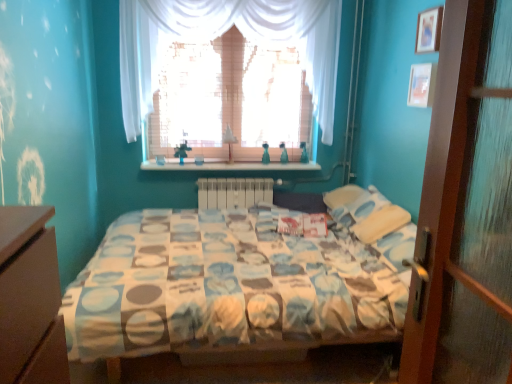
Question: Does wooden shelf at center have a lesser width compared to wooden picture frame at upper right, the 1th picture frame when ordered from bottom to top?

Choices:
 (A) no
 (B) yes

Answer: (A)

Question: Considering the relative sizes of wooden shelf at center and wooden picture frame at upper right, the 2th picture frame positioned from the top, in the image provided, is wooden shelf at center wider than wooden picture frame at upper right, the 2th picture frame positioned from the top,?

Choices:
 (A) yes
 (B) no

Answer: (A)

Question: Is wooden shelf at center not near wooden picture frame at upper right, the 2th picture frame positioned from the top?

Choices:
 (A) yes
 (B) no

Answer: (A)

Question: Is wooden shelf at center further to the viewer compared to wooden picture frame at upper right, the 1th picture frame when ordered from bottom to top?

Choices:
 (A) no
 (B) yes

Answer: (B)

Question: Is wooden picture frame at upper right, the 2th picture frame positioned from the top, a part of wooden shelf at center?

Choices:
 (A) no
 (B) yes

Answer: (A)

Question: Considering the positions of point (426, 36) and point (248, 203), is point (426, 36) closer or farther from the camera than point (248, 203)?

Choices:
 (A) farther
 (B) closer

Answer: (B)

Question: Considering the positions of wooden picture frame at upper right, which appears as the second picture frame when ordered from the bottom, and white plastic radiator at center in the image, is wooden picture frame at upper right, which appears as the second picture frame when ordered from the bottom, taller or shorter than white plastic radiator at center?

Choices:
 (A) short
 (B) tall

Answer: (A)

Question: Is wooden picture frame at upper right, which appears as the second picture frame when ordered from the bottom, spatially inside white plastic radiator at center, or outside of it?

Choices:
 (A) outside
 (B) inside

Answer: (A)

Question: Is wooden picture frame at upper right, which is the first picture frame from top to bottom, bigger or smaller than white plastic radiator at center?

Choices:
 (A) small
 (B) big

Answer: (A)

Question: From a real-world perspective, relative to wooden picture frame at upper right, which is the first picture frame from top to bottom, is white sheer curtain at upper center vertically above or below?

Choices:
 (A) below
 (B) above

Answer: (A)

Question: Would you say white sheer curtain at upper center is inside or outside wooden picture frame at upper right, which is the first picture frame from top to bottom?

Choices:
 (A) inside
 (B) outside

Answer: (B)

Question: Considering the positions of white sheer curtain at upper center and wooden picture frame at upper right, which appears as the second picture frame when ordered from the bottom, in the image, is white sheer curtain at upper center bigger or smaller than wooden picture frame at upper right, which appears as the second picture frame when ordered from the bottom,?

Choices:
 (A) big
 (B) small

Answer: (A)

Question: In terms of height, does white sheer curtain at upper center look taller or shorter compared to wooden picture frame at upper right, which appears as the second picture frame when ordered from the bottom?

Choices:
 (A) short
 (B) tall

Answer: (B)

Question: In terms of size, does wooden picture frame at upper right, the 1th picture frame when ordered from bottom to top, appear bigger or smaller than white sheer curtain at upper center?

Choices:
 (A) small
 (B) big

Answer: (A)

Question: From a real-world perspective, is wooden picture frame at upper right, the 1th picture frame when ordered from bottom to top, positioned above or below white sheer curtain at upper center?

Choices:
 (A) below
 (B) above

Answer: (A)